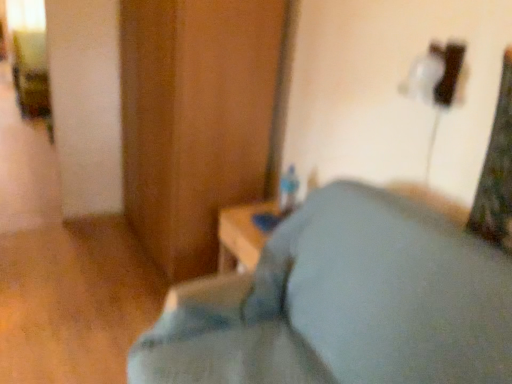
Question: Visually, is wooden dresser at center positioned to the left or to the right of light blue fabric pillow at lower center?

Choices:
 (A) right
 (B) left

Answer: (B)

Question: From a real-world perspective, relative to light blue fabric pillow at lower center, is wooden dresser at center vertically above or below?

Choices:
 (A) below
 (B) above

Answer: (B)

Question: Do you think wooden dresser at center is within light blue fabric pillow at lower center, or outside of it?

Choices:
 (A) outside
 (B) inside

Answer: (A)

Question: Choose the correct answer: Is light blue fabric pillow at lower center inside wooden dresser at center or outside it?

Choices:
 (A) outside
 (B) inside

Answer: (A)

Question: Visually, is light blue fabric pillow at lower center positioned to the left or to the right of wooden dresser at center?

Choices:
 (A) right
 (B) left

Answer: (A)

Question: Is light blue fabric pillow at lower center in front of or behind wooden dresser at center in the image?

Choices:
 (A) behind
 (B) front

Answer: (B)

Question: Does point (330, 195) appear closer or farther from the camera than point (198, 158)?

Choices:
 (A) closer
 (B) farther

Answer: (A)